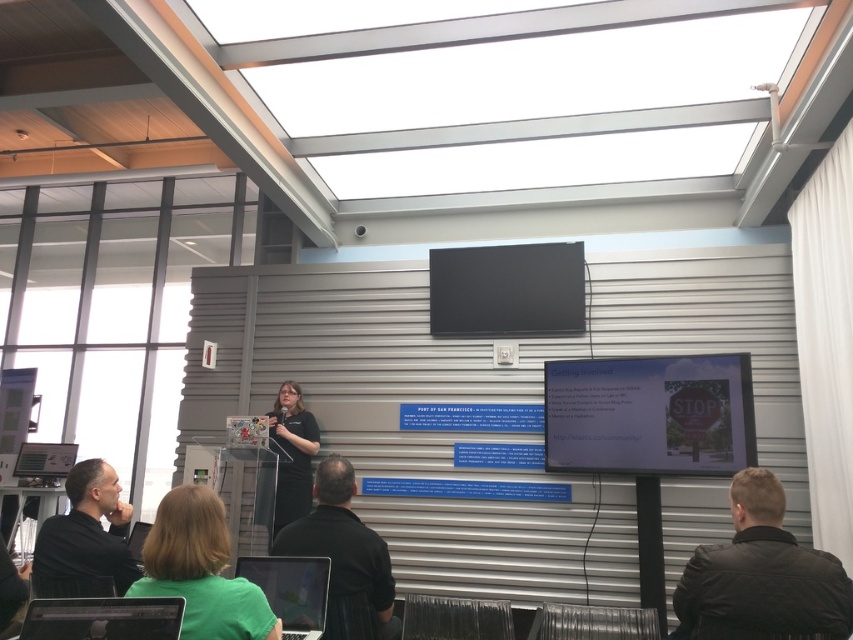
From the picture: You are a presenter standing at the podium and need to check the distance between the two matte black laptops in the front row. Can you confirm if the distance between the matte black laptop at lower left and the matte black laptop at lower center is more than 24 inches?

The matte black laptop at lower left and matte black laptop at lower center are 24.11 inches apart from each other, so the distance is just over 24 inches, meaning it is more than 24 inches.

You are a presenter standing at the podium and want to place your notes on the floor near the matte black laptop at lower left. Where should you place them?

Place your notes near the floor at coordinates approximately 0.967 on the x and 0.122 on the y axis, which corresponds to the location of the matte black laptop at lower left.